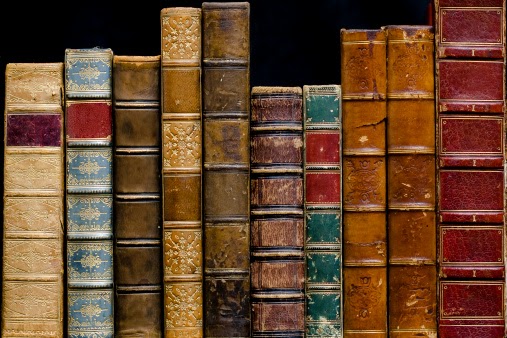
Find the location of a particular element. hardcover books is located at coordinates (28, 181), (83, 186), (127, 187), (173, 181), (222, 175), (267, 185), (322, 191), (368, 192), (470, 188), (417, 190).